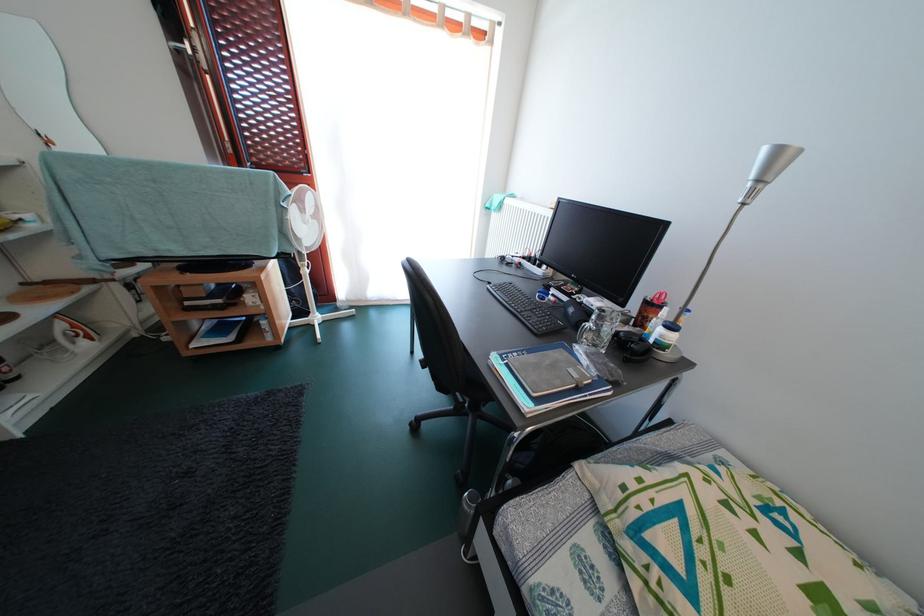
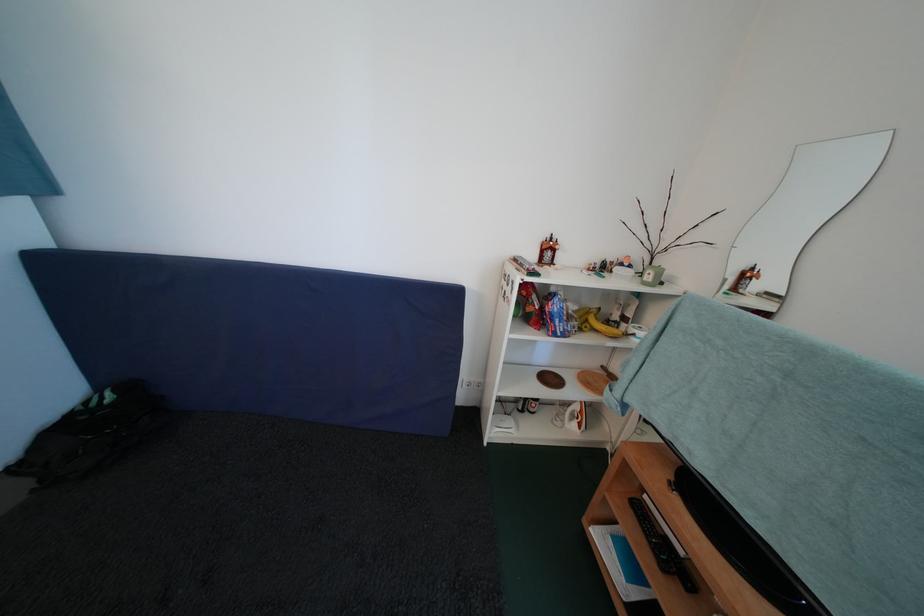
Find the pixel in the second image that matches pixel 68 331 in the first image.

(584, 411)